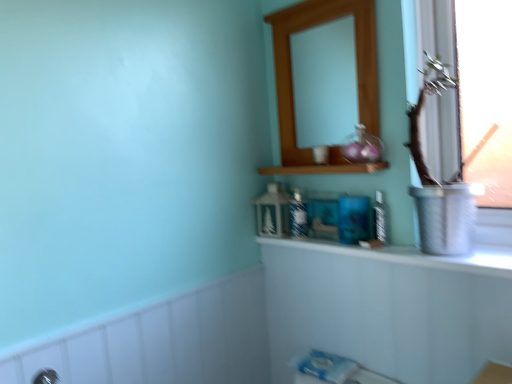
You are a GUI agent. You are given a task and a screenshot of the screen. Output one action in this format:
    pyautogui.click(x=<x>, y=<y>)
    Task: Click on the clear plastic bottle at center, positioned as the 1th toiletry in right-to-left order
    
    Given the screenshot: What is the action you would take?
    pyautogui.click(x=381, y=219)

Describe the element at coordinates (292, 80) in the screenshot. I see `wooden medicine cabinet at upper center` at that location.

Describe the element at coordinates (412, 255) in the screenshot. I see `white glossy counter top at upper center` at that location.

How much space does matte blue glass toiletry at center, positioned as the second toiletry in right-to-left order, occupy vertically?

matte blue glass toiletry at center, positioned as the second toiletry in right-to-left order, is 7.08 inches in height.

In order to face matte blue glass toiletry at center, positioned as the second toiletry in right-to-left order, should I rotate leftwards or rightwards?

To align with it, rotate right about 5.655°.

Describe the element at coordinates (440, 135) in the screenshot. I see `metallic silver vase at right` at that location.

I want to click on white textured bath at lower left, so click(x=166, y=341).

From a real-world perspective, which object rests below the other?

From a 3D spatial view, matte blue glass toiletry at center, positioned as the second toiletry in right-to-left order, is below.

Would you say metallic silver vase at right is to the left or to the right of matte blue glass toiletry at center, which is the second toiletry from front to back, in the picture?

metallic silver vase at right is to the right of matte blue glass toiletry at center, which is the second toiletry from front to back.

Is metallic silver vase at right inside or outside of matte blue glass toiletry at center, which is the second toiletry from front to back?

metallic silver vase at right exists outside the volume of matte blue glass toiletry at center, which is the second toiletry from front to back.

Where is `the 1st toiletry positioned below the metallic silver vase at right (from a real-world perspective)`? The height and width of the screenshot is (384, 512). the 1st toiletry positioned below the metallic silver vase at right (from a real-world perspective) is located at coordinates (298, 215).

Is point (359, 83) positioned before point (261, 321)?

Yes, point (359, 83) is closer to viewer.

Between wooden medicine cabinet at upper center and white textured bath at lower left, which one has less height?

Standing shorter between the two is white textured bath at lower left.

Can you tell me how much wooden medicine cabinet at upper center and white textured bath at lower left differ in facing direction?

90.1 degrees separate the facing orientations of wooden medicine cabinet at upper center and white textured bath at lower left.

Based on their sizes in the image, would you say wooden medicine cabinet at upper center is bigger or smaller than white textured bath at lower left?

Clearly, wooden medicine cabinet at upper center is smaller in size than white textured bath at lower left.

From a real-world perspective, is clear plastic bottle at center, positioned as the 1th toiletry in right-to-left order, under metallic silver vase at right?

Yes, from a real-world perspective, clear plastic bottle at center, positioned as the 1th toiletry in right-to-left order, is beneath metallic silver vase at right.

From the image's perspective, is clear plastic bottle at center, positioned as the 1th toiletry in right-to-left order, positioned above or below metallic silver vase at right?

clear plastic bottle at center, positioned as the 1th toiletry in right-to-left order, is below metallic silver vase at right.

This screenshot has width=512, height=384. In the image, there is a clear plastic bottle at center, the first toiletry from the front. Find the location of `window above it (from the image's perspective)`. window above it (from the image's perspective) is located at coordinates (440, 135).

How different are the orientations of clear plastic bottle at center, which is counted as the second toiletry, starting from the left, and white textured bath at lower left in degrees?

The angle between the facing direction of clear plastic bottle at center, which is counted as the second toiletry, starting from the left, and the facing direction of white textured bath at lower left is 89.3 degrees.

Which object is further away from the camera taking this photo, clear plastic bottle at center, positioned as the 1th toiletry in right-to-left order, or white textured bath at lower left?

clear plastic bottle at center, positioned as the 1th toiletry in right-to-left order.

Are clear plastic bottle at center, which is counted as the second toiletry, starting from the left, and white textured bath at lower left making contact?

No, clear plastic bottle at center, which is counted as the second toiletry, starting from the left, is not in contact with white textured bath at lower left.

Is clear plastic bottle at center, which appears as the second toiletry when viewed from the back, wider than wooden medicine cabinet at upper center?

No, clear plastic bottle at center, which appears as the second toiletry when viewed from the back, is not wider than wooden medicine cabinet at upper center.

Is point (385, 229) more distant than point (286, 166)?

No.

Is clear plastic bottle at center, positioned as the 1th toiletry in right-to-left order, looking in the opposite direction of wooden medicine cabinet at upper center?

No, clear plastic bottle at center, positioned as the 1th toiletry in right-to-left order, is not facing away from wooden medicine cabinet at upper center.

Is matte blue glass toiletry at center, positioned as the second toiletry in right-to-left order, smaller than metallic silver vase at right?

Correct, matte blue glass toiletry at center, positioned as the second toiletry in right-to-left order, occupies less space than metallic silver vase at right.

From the image's perspective, is matte blue glass toiletry at center, which is the second toiletry from front to back, located above metallic silver vase at right?

No.

Does matte blue glass toiletry at center, which is counted as the first toiletry, starting from the back, have a lesser height compared to metallic silver vase at right?

Correct, matte blue glass toiletry at center, which is counted as the first toiletry, starting from the back, is not as tall as metallic silver vase at right.

From a real-world perspective, between matte blue glass toiletry at center, which is counted as the first toiletry, starting from the back, and clear plastic bottle at center, the first toiletry from the front, who is vertically lower?

In real-world perspective, clear plastic bottle at center, the first toiletry from the front, is lower.

Find the location of a particular element. The height and width of the screenshot is (384, 512). toiletry behind the clear plastic bottle at center, the first toiletry from the front is located at coordinates (298, 215).

Between matte blue glass toiletry at center, positioned as the second toiletry in right-to-left order, and clear plastic bottle at center, which appears as the second toiletry when viewed from the back, which one has less height?

With less height is clear plastic bottle at center, which appears as the second toiletry when viewed from the back.

Identify the location of window to the right of matte blue glass toiletry at center, which is counted as the first toiletry, starting from the back. The width and height of the screenshot is (512, 384). (440, 135).

Where is `medicine cabinet behind the white textured bath at lower left`? The image size is (512, 384). medicine cabinet behind the white textured bath at lower left is located at coordinates tap(292, 80).

Which object lies nearer to the anchor point matte blue glass toiletry at center, which is counted as the first toiletry, starting from the back, white glossy counter top at upper center or metallic silver vase at right?

Among the two, white glossy counter top at upper center is located nearer to matte blue glass toiletry at center, which is counted as the first toiletry, starting from the back.

Based on their spatial positions, is wooden shelf at upper center or white textured bath at lower left closer to metallic silver vase at right?

wooden shelf at upper center.

Based on their spatial positions, is wooden shelf at upper center or metallic silver vase at right closer to white textured bath at lower left?

The object closer to white textured bath at lower left is wooden shelf at upper center.

Consider the image. When comparing their distances from metallic silver vase at right, does wooden medicine cabinet at upper center or clear plastic bottle at center, positioned as the 1th toiletry in right-to-left order, seem further?

The object further to metallic silver vase at right is clear plastic bottle at center, positioned as the 1th toiletry in right-to-left order.

Estimate the real-world distances between objects in this image. Which object is further from metallic silver vase at right, wooden medicine cabinet at upper center or wooden shelf at upper center?

wooden shelf at upper center is further to metallic silver vase at right.

From the picture: Based on their spatial positions, is matte blue glass toiletry at center, positioned as the second toiletry in right-to-left order, or metallic silver vase at right closer to white glossy counter top at upper center?

Among the two, matte blue glass toiletry at center, positioned as the second toiletry in right-to-left order, is located nearer to white glossy counter top at upper center.

From the image, which object appears to be farther from wooden shelf at upper center, white glossy counter top at upper center or wooden medicine cabinet at upper center?

white glossy counter top at upper center is positioned further to the anchor wooden shelf at upper center.

When comparing their distances from white glossy counter top at upper center, does wooden shelf at upper center or white textured bath at lower left seem closer?

Based on the image, wooden shelf at upper center appears to be nearer to white glossy counter top at upper center.

The height and width of the screenshot is (384, 512). Identify the location of window between wooden medicine cabinet at upper center and matte blue glass toiletry at center, which is the 1th toiletry in left-to-right order, in the vertical direction. (440, 135).

In order to click on toiletry between white glossy counter top at upper center and matte blue glass toiletry at center, which is the second toiletry from front to back, along the z-axis in this screenshot , I will do `click(381, 219)`.

The width and height of the screenshot is (512, 384). I want to click on shelf between matte blue glass toiletry at center, positioned as the second toiletry in right-to-left order, and clear plastic bottle at center, which is counted as the second toiletry, starting from the left, so click(x=325, y=168).

This screenshot has width=512, height=384. Find the location of `counter top located between white textured bath at lower left and metallic silver vase at right in the left-right direction`. counter top located between white textured bath at lower left and metallic silver vase at right in the left-right direction is located at coordinates (412, 255).